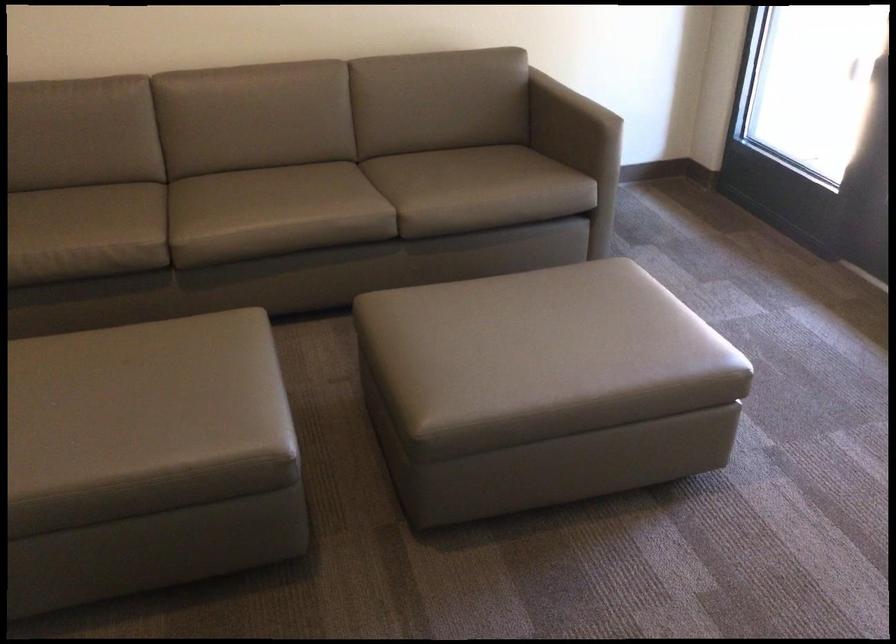
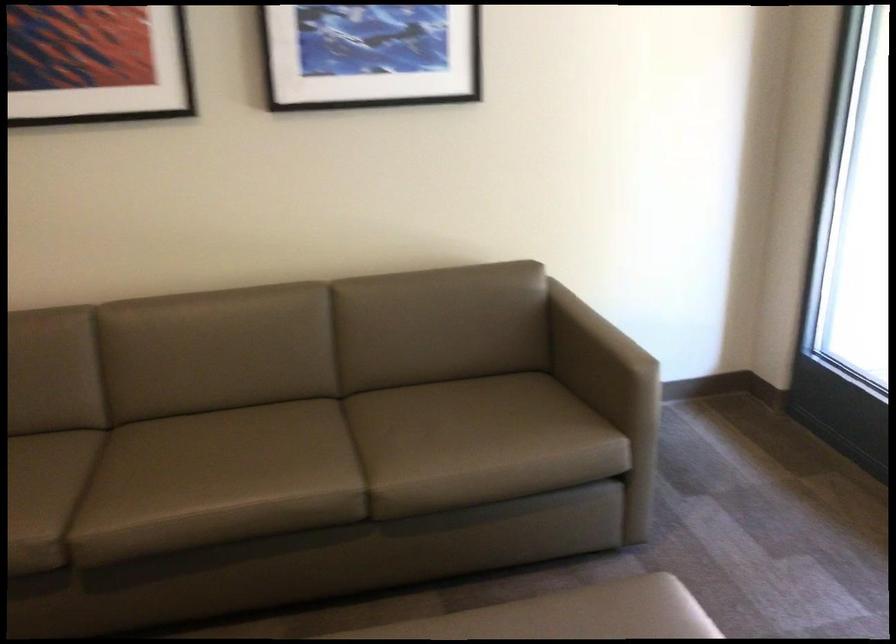
In the second image, find the point that corresponds to point 373,185 in the first image.

(356, 450)